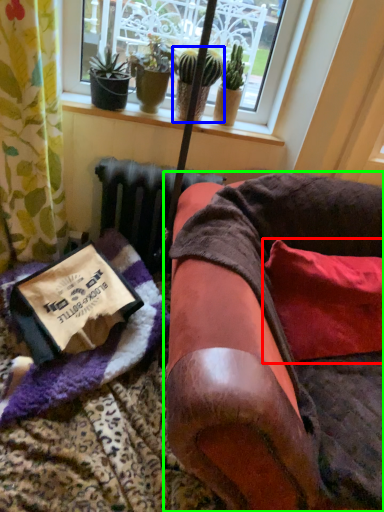
Question: Considering the real-world distances, which object is closest to pillow (highlighted by a red box)? houseplant (highlighted by a blue box) or furniture (highlighted by a green box).

Choices:
 (A) houseplant
 (B) furniture

Answer: (B)